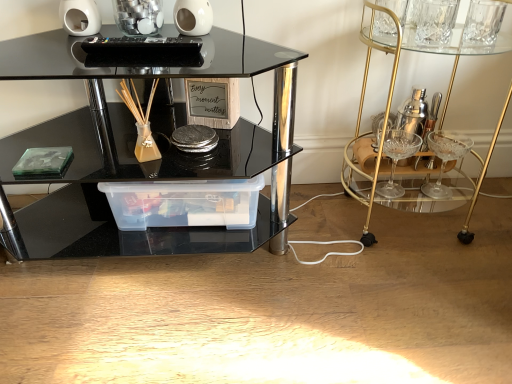
At what (x,y) coordinates should I click in order to perform the action: click on free space between black glass table at center and gold glass bar cart at right. Please return your answer as a coordinate pair (x, y). The width and height of the screenshot is (512, 384). Looking at the image, I should click on (342, 240).